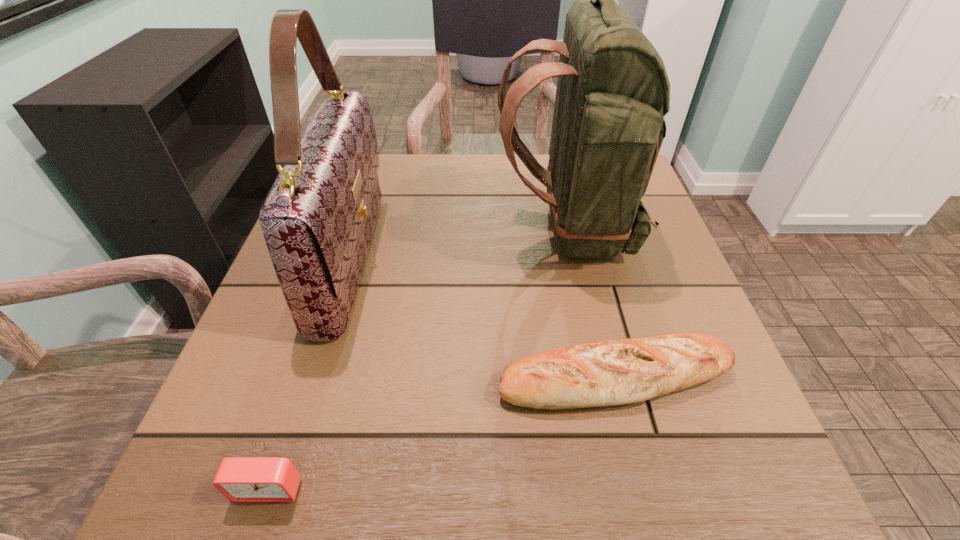
Where is `vacant space at the near edge`? vacant space at the near edge is located at coordinates (449, 492).

Where is `vacant space at the left edge`? This screenshot has height=540, width=960. vacant space at the left edge is located at coordinates (228, 401).

Identify the location of free space at the right edge of the desktop. (642, 273).

You are a GUI agent. You are given a task and a screenshot of the screen. Output one action in this format:
    pyautogui.click(x=<x>, y=<y>)
    Task: Click on the vacant area at the near left corner of the desktop
    
    Given the screenshot: What is the action you would take?
    pyautogui.click(x=227, y=453)

The width and height of the screenshot is (960, 540). I want to click on free spot between the baguet and the nearest object, so click(442, 433).

This screenshot has width=960, height=540. Find the location of `free space that is in between the alarm clock and the backpack`. free space that is in between the alarm clock and the backpack is located at coordinates (418, 358).

The height and width of the screenshot is (540, 960). Identify the location of free area in between the baguet and the backpack. (590, 303).

The image size is (960, 540). Identify the location of vacant region between the alarm clock and the handbag. pyautogui.click(x=310, y=373).

Find the location of a particular element. The image size is (960, 540). free space between the backpack and the baguet is located at coordinates (590, 303).

At what (x,y) coordinates should I click in order to perform the action: click on free space between the handbag and the backpack. Please return your answer as a coordinate pair (x, y). The width and height of the screenshot is (960, 540). Looking at the image, I should click on (459, 244).